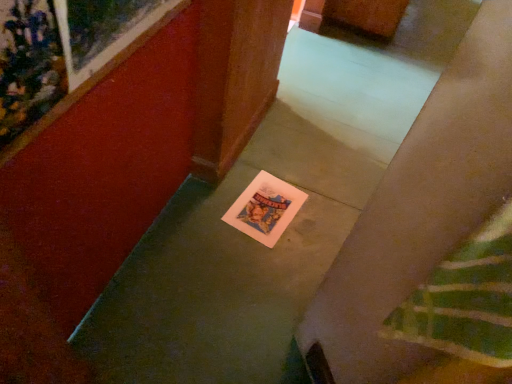
The image size is (512, 384). Identify the location of free area behind white paper postcard at center. (273, 173).